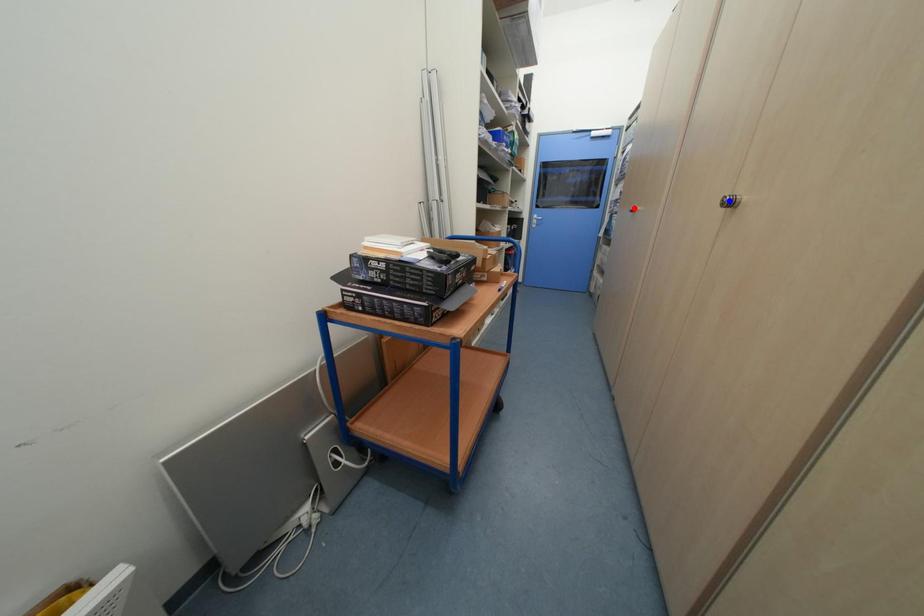
Question: In the image, two points are highlighted. Which point is nearer to the camera? Reply with the corresponding letter.

Choices:
 (A) blue point
 (B) red point

Answer: (A)